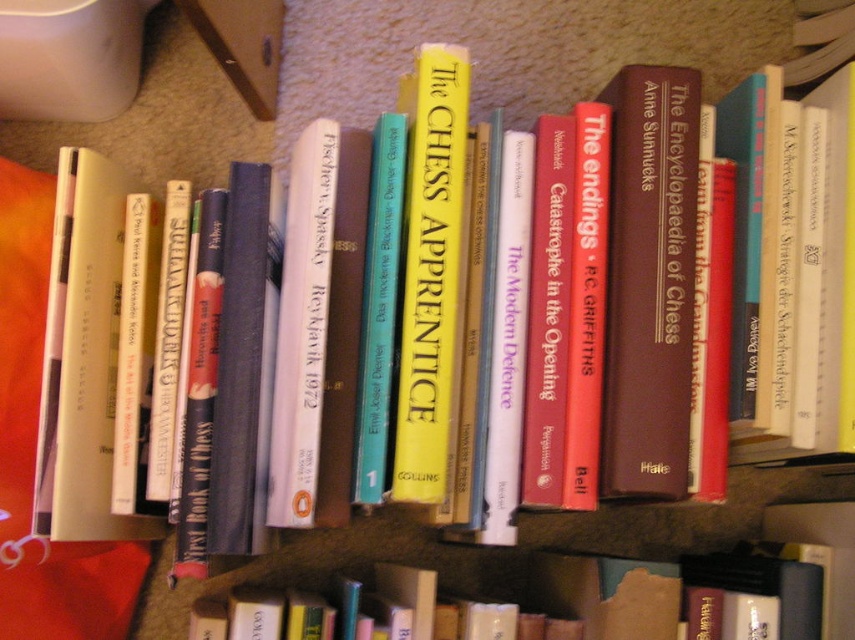
Between white fabric pillow at left and yellow paperback book at center, which one appears on the right side from the viewer's perspective?

Positioned to the right is yellow paperback book at center.

Is point (113, 586) in front of point (449, 51)?

No, it is not.

Is point (10, 454) farther from viewer compared to point (429, 81)?

Yes.

Locate an element on the screen. This screenshot has height=640, width=855. white fabric pillow at left is located at coordinates (34, 451).

Can you confirm if brown hardcover book at center is positioned above yellow paperback book at center?

No.

Does brown hardcover book at center have a larger size compared to yellow paperback book at center?

Correct, brown hardcover book at center is larger in size than yellow paperback book at center.

This screenshot has height=640, width=855. What do you see at coordinates (649, 282) in the screenshot? I see `brown hardcover book at center` at bounding box center [649, 282].

The width and height of the screenshot is (855, 640). I want to click on brown hardcover book at center, so click(x=649, y=282).

Does brown hardcover book at center have a lesser width compared to hardcover book at center?

Indeed, brown hardcover book at center has a lesser width compared to hardcover book at center.

Is brown hardcover book at center shorter than hardcover book at center?

No.

Is point (671, 364) behind point (644, 604)?

Yes, it is.

Image resolution: width=855 pixels, height=640 pixels. What are the coordinates of `brown hardcover book at center` in the screenshot? It's located at (649, 282).